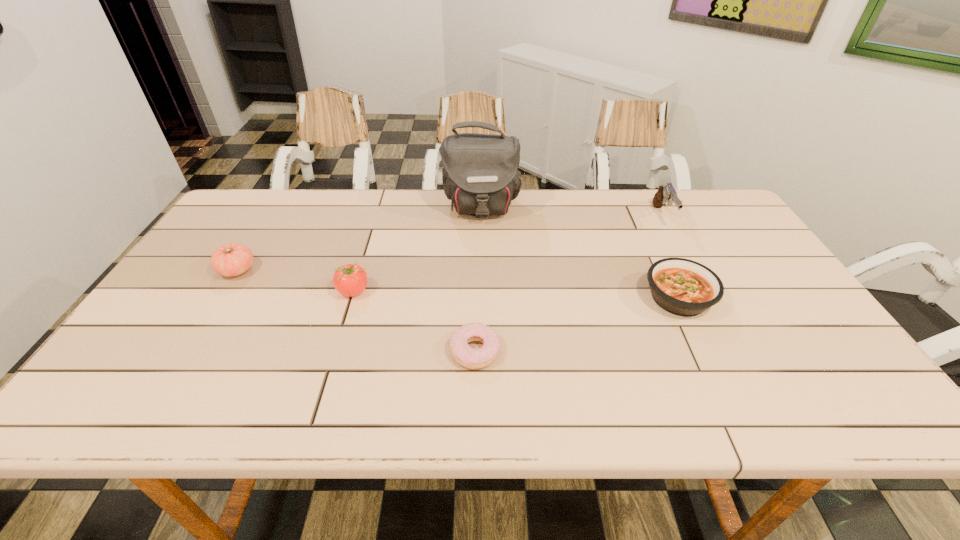
The height and width of the screenshot is (540, 960). I want to click on free space between the second tallest object and the right tomato, so click(508, 254).

Where is `the fourth closest object to the shortest object`? This screenshot has height=540, width=960. the fourth closest object to the shortest object is located at coordinates (233, 259).

At what (x,y) coordinates should I click in order to perform the action: click on object that stands as the fifth closest to the fifth object from right to left. Please return your answer as a coordinate pair (x, y). This screenshot has height=540, width=960. Looking at the image, I should click on (667, 193).

This screenshot has height=540, width=960. In order to click on free space that satisfies the following two spatial constraints: 1. on the open flap of the second shortest object; 2. on the right side of the tallest object in this screenshot , I will do `click(481, 299)`.

You are a GUI agent. You are given a task and a screenshot of the screen. Output one action in this format:
    pyautogui.click(x=<x>, y=<y>)
    Task: Click on the vacant space that satisfies the following two spatial constraints: 1. on the open flap of the tallest object; 2. on the right side of the stew
    
    Given the screenshot: What is the action you would take?
    pyautogui.click(x=481, y=299)